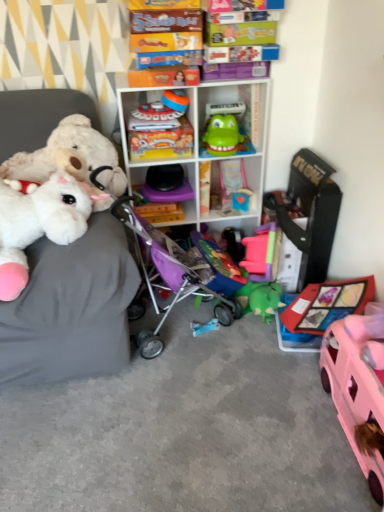
Question: From a real-world perspective, is translucent plastic xylophone at center, acting as the second shelf starting from the top, over fluffy white plush at left, the 1th toy when ordered from left to right?

Choices:
 (A) no
 (B) yes

Answer: (A)

Question: Considering the relative sizes of translucent plastic xylophone at center, arranged as the 1th shelf when ordered from the bottom, and fluffy white plush at left, the 1th toy when ordered from left to right, in the image provided, is translucent plastic xylophone at center, arranged as the 1th shelf when ordered from the bottom, smaller than fluffy white plush at left, the 1th toy when ordered from left to right,?

Choices:
 (A) no
 (B) yes

Answer: (B)

Question: Is translucent plastic xylophone at center, arranged as the 1th shelf when ordered from the bottom, oriented away from fluffy white plush at left, which is the 10th toy from right to left?

Choices:
 (A) yes
 (B) no

Answer: (B)

Question: Is the position of translucent plastic xylophone at center, acting as the second shelf starting from the top, less distant than that of fluffy white plush at left, which is the 10th toy from right to left?

Choices:
 (A) yes
 (B) no

Answer: (B)

Question: Considering the relative sizes of translucent plastic xylophone at center, acting as the second shelf starting from the top, and fluffy white plush at left, the 1th toy when ordered from left to right, in the image provided, is translucent plastic xylophone at center, acting as the second shelf starting from the top, taller than fluffy white plush at left, the 1th toy when ordered from left to right,?

Choices:
 (A) no
 (B) yes

Answer: (A)

Question: Are translucent plastic xylophone at center, acting as the second shelf starting from the top, and fluffy white plush at left, which is the 10th toy from right to left, far apart?

Choices:
 (A) no
 (B) yes

Answer: (A)

Question: Is the position of fluffy white plush at left, the 2th toy viewed from the left, less distant than that of matte yellow board game at center, arranged as the seventh toy when viewed from the right?

Choices:
 (A) yes
 (B) no

Answer: (A)

Question: Is fluffy white plush at left, the 2th toy viewed from the left, behind matte yellow board game at center, the 4th toy when ordered from left to right?

Choices:
 (A) no
 (B) yes

Answer: (A)

Question: Is fluffy white plush at left, which appears as the 9th toy when viewed from the right, taller than matte yellow board game at center, arranged as the seventh toy when viewed from the right?

Choices:
 (A) yes
 (B) no

Answer: (A)

Question: Does fluffy white plush at left, which appears as the 9th toy when viewed from the right, have a smaller size compared to matte yellow board game at center, the 4th toy when ordered from left to right?

Choices:
 (A) no
 (B) yes

Answer: (A)

Question: From the image's perspective, is fluffy white plush at left, the 2th toy viewed from the left, beneath matte yellow board game at center, the 4th toy when ordered from left to right?

Choices:
 (A) yes
 (B) no

Answer: (A)

Question: From the image's perspective, is fluffy white plush at left, which appears as the 9th toy when viewed from the right, on matte yellow board game at center, the 4th toy when ordered from left to right?

Choices:
 (A) no
 (B) yes

Answer: (A)

Question: Does black plastic toy at center, the eighth toy viewed from the left, appear on the right side of fluffy white stuffed animals on the left?

Choices:
 (A) no
 (B) yes

Answer: (B)